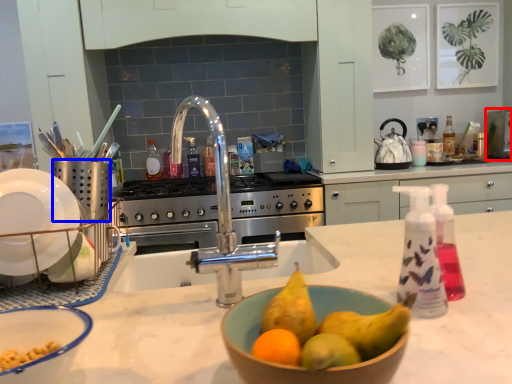
Question: Which of the following is the farthest to the observer, appliance (highlighted by a red box) or appliance (highlighted by a blue box)?

Choices:
 (A) appliance
 (B) appliance

Answer: (A)